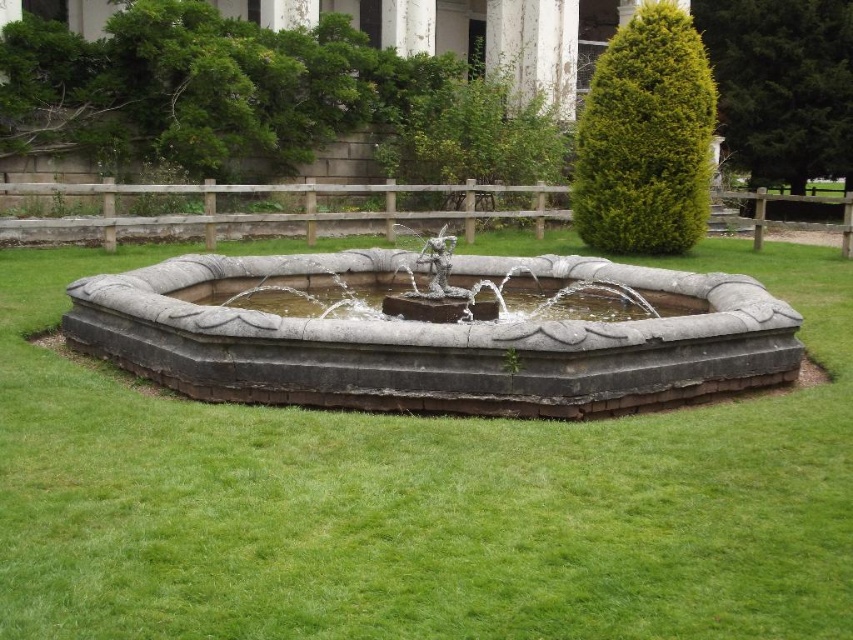
Question: Can you confirm if gray stone fountain at center is smaller than clear water at fountain center?

Choices:
 (A) yes
 (B) no

Answer: (B)

Question: Based on their relative distances, which object is nearer to the clear water at fountain center?

Choices:
 (A) green grass at center
 (B) gray stone fountain at center

Answer: (B)

Question: Among these objects, which one is nearest to the camera?

Choices:
 (A) green grass at center
 (B) clear water at fountain center
 (C) gray stone fountain at center

Answer: (A)

Question: Can you confirm if green grass at center is thinner than clear water at fountain center?

Choices:
 (A) yes
 (B) no

Answer: (B)

Question: Which of the following is the closest to the observer?

Choices:
 (A) clear water at fountain center
 (B) green grass at center

Answer: (B)

Question: Where is gray stone fountain at center located in relation to clear water at fountain center in the image?

Choices:
 (A) left
 (B) right

Answer: (B)